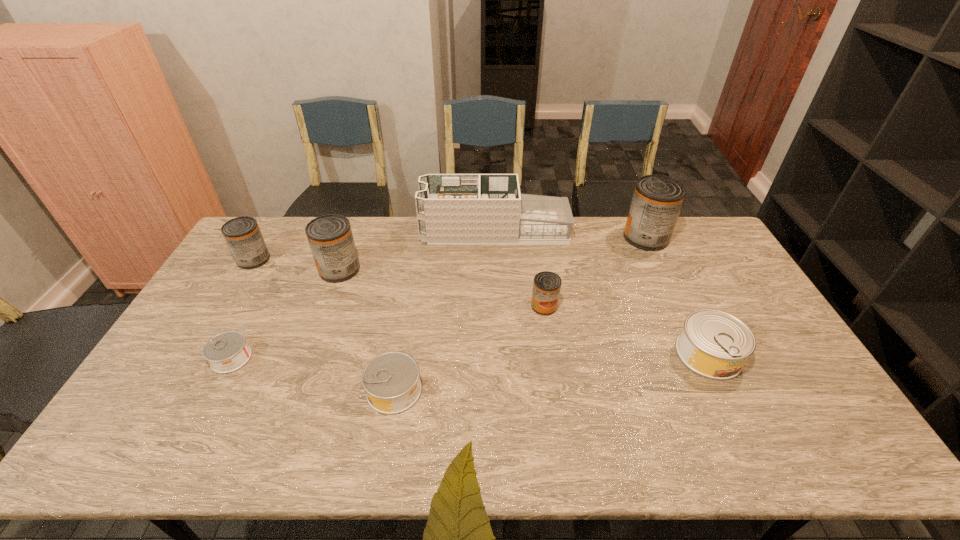
You are a GUI agent. You are given a task and a screenshot of the screen. Output one action in this format:
    pyautogui.click(x=<x>, y=<y>)
    Task: Click on the vacant area situated 0.230m on the back of the nearest red can
    The width and height of the screenshot is (960, 540).
    Given the screenshot: What is the action you would take?
    pyautogui.click(x=536, y=252)

Where is `vacant point located on the right of the rightmost silver can`? The width and height of the screenshot is (960, 540). vacant point located on the right of the rightmost silver can is located at coordinates (762, 354).

The image size is (960, 540). I want to click on vacant space located 0.080m on the left of the second smallest silver can, so click(336, 390).

At what (x,y) coordinates should I click in order to perform the action: click on blank area located 0.100m on the left of the shortest can. Please return your answer as a coordinate pair (x, y). The height and width of the screenshot is (540, 960). Looking at the image, I should click on (176, 358).

In order to click on dollhouse located at the far edge in this screenshot , I will do `click(452, 209)`.

Identify the location of object that is at the right edge. The image size is (960, 540). pyautogui.click(x=714, y=344).

This screenshot has width=960, height=540. Identify the location of object at the far left corner. (242, 234).

Find the location of a particular element. vacant area at the far edge is located at coordinates (594, 217).

At what (x,y) coordinates should I click in order to perform the action: click on vacant space at the near edge. Please return your answer as a coordinate pair (x, y). This screenshot has width=960, height=540. Looking at the image, I should click on (205, 454).

Where is `free spot at the left edge of the desktop`? free spot at the left edge of the desktop is located at coordinates [162, 372].